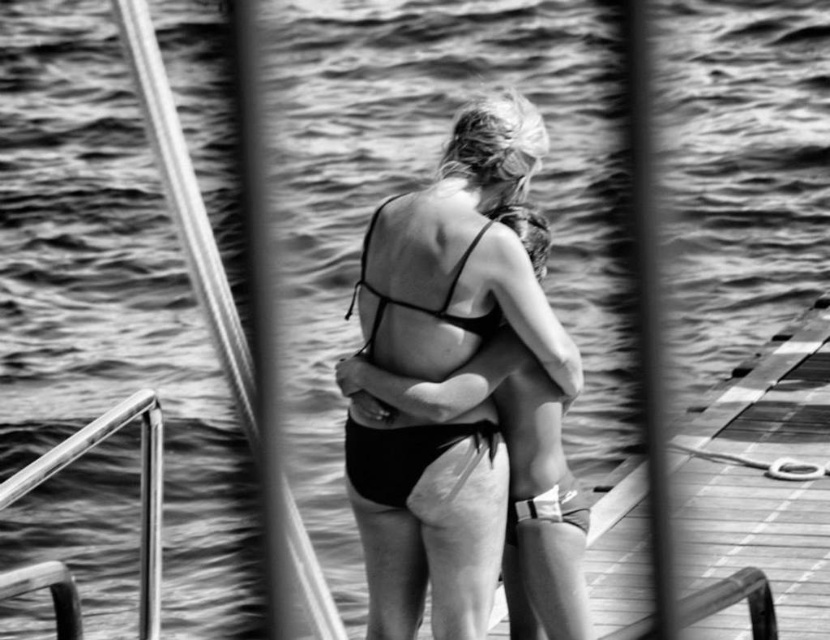
You are a photographer trying to capture a clear shot of the polished metal rail at left and the black matte bikini top at center. Which object is shorter in height?

The polished metal rail at left has a lesser height compared to the black matte bikini top at center, so the polished metal rail at left is shorter in height.